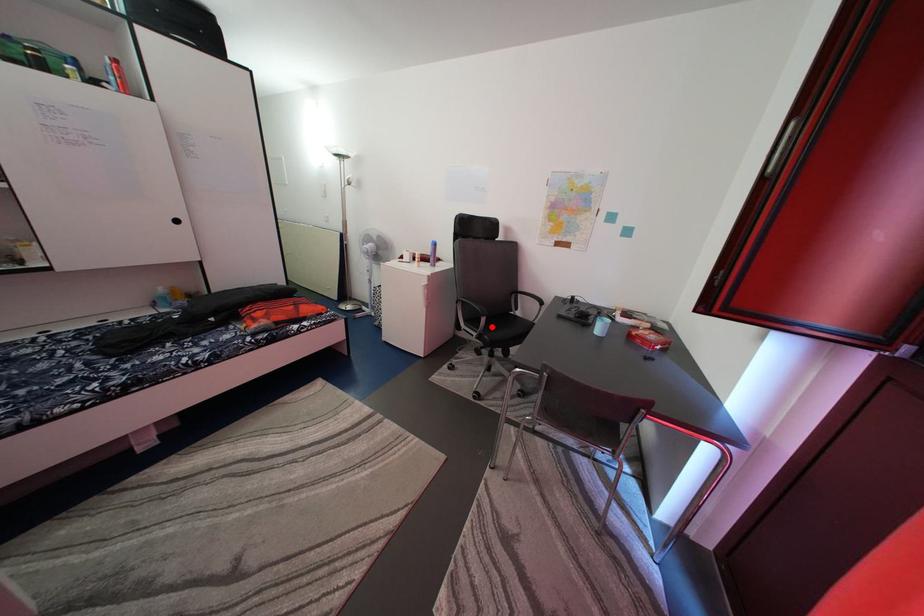
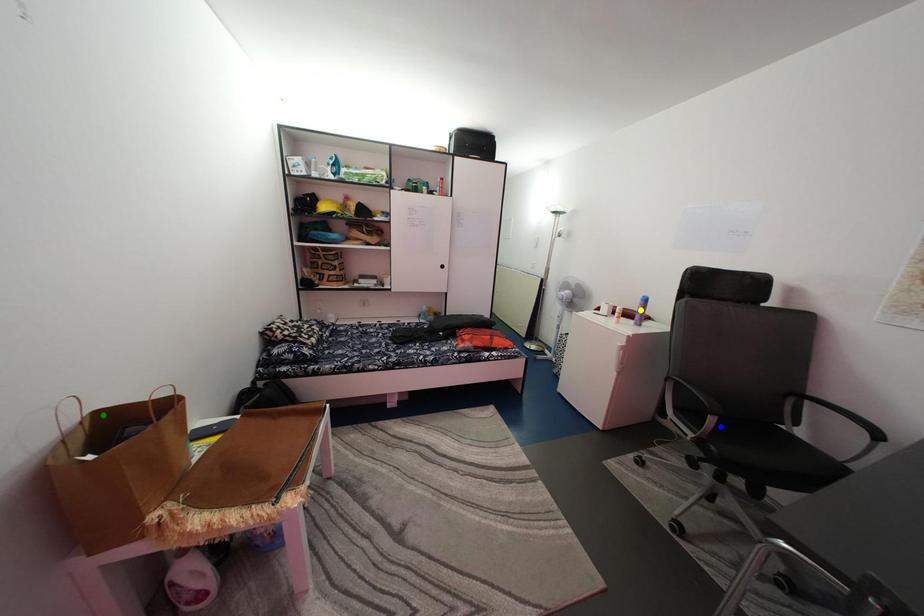
Question: I am providing you with two images of the same scene from different viewpoints. A red point is marked on the first image. You are given multiple points on the second image. Which point in image 2 represents the same 3d spot as the red point in image 1?

Choices:
 (A) green point
 (B) yellow point
 (C) blue point

Answer: (C)